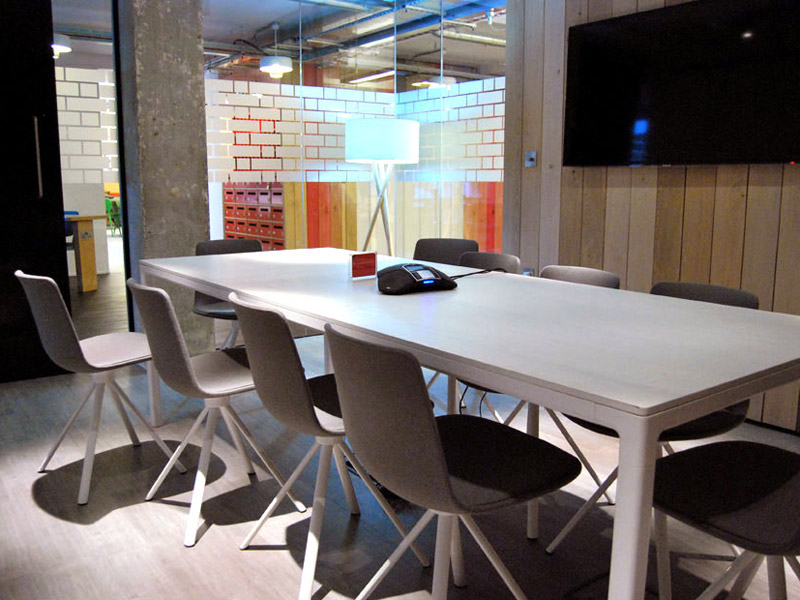
At what (x,y) coordinates should I click in order to perform the action: click on floor besides tha table and chairs. Please return your answer as a coordinate pair (x, y). This screenshot has height=600, width=800. Looking at the image, I should click on (40, 554).